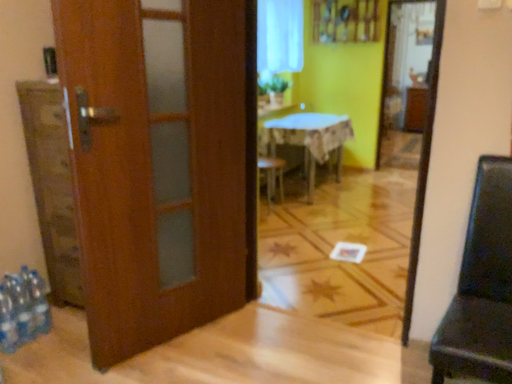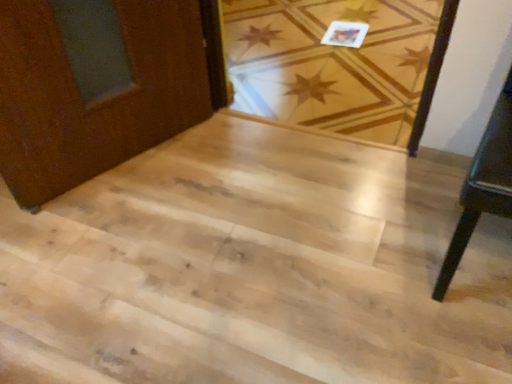
Question: How did the camera likely rotate when shooting the video?

Choices:
 (A) rotated upward
 (B) rotated downward

Answer: (B)